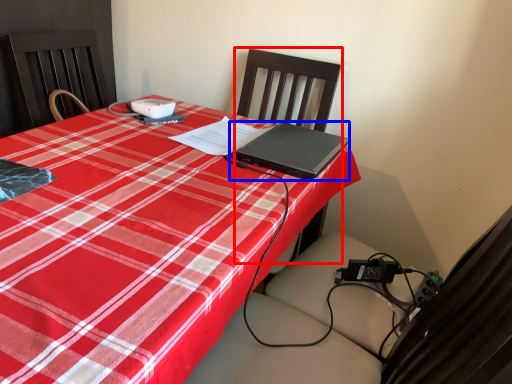
Question: Which object is closer to the camera taking this photo, chair (highlighted by a red box) or laptop (highlighted by a blue box)?

Choices:
 (A) chair
 (B) laptop

Answer: (A)